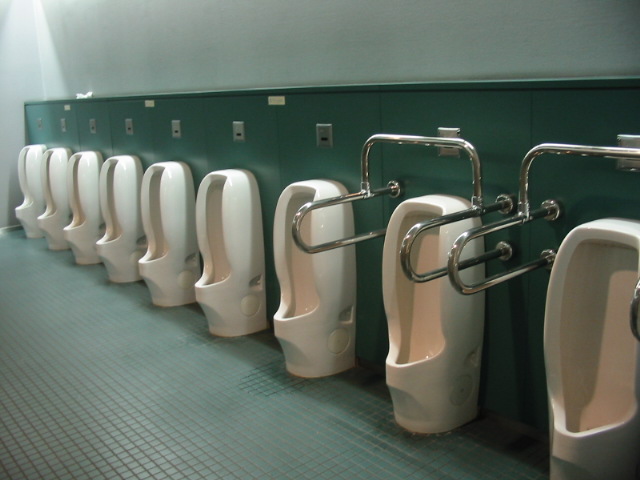
What are the coordinates of `urinals` in the screenshot? It's located at (604, 409), (436, 349), (321, 331), (248, 287), (176, 269), (105, 238), (82, 231), (54, 210), (28, 206).